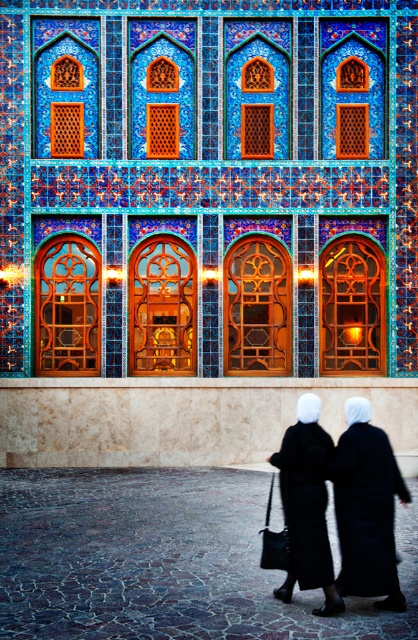
The image size is (418, 640). I want to click on blue mosaic tiles at center, so [203, 225].

Between blue mosaic tiles at center and black matte hijab at center, which one appears on the left side from the viewer's perspective?

From the viewer's perspective, blue mosaic tiles at center appears more on the left side.

Which is in front, point (12, 61) or point (407, 499)?

Point (407, 499) is in front.

Find the location of a particular element. blue mosaic tiles at center is located at coordinates (203, 225).

Which is below, black matte hijab at center or black matte robe at lower center?

black matte hijab at center is below.

Is black matte hijab at center wider than black matte robe at lower center?

No, black matte hijab at center is not wider than black matte robe at lower center.

Describe the element at coordinates (367, 508) in the screenshot. The width and height of the screenshot is (418, 640). I see `black matte hijab at center` at that location.

Locate an element on the screen. This screenshot has height=640, width=418. black matte hijab at center is located at coordinates (367, 508).

Who is shorter, blue mosaic tiles at center or black matte robe at center?

→ With less height is black matte robe at center.

Which is behind, point (181, 51) or point (325, 432)?

Point (181, 51)

Find the location of a particular element. This screenshot has width=418, height=640. blue mosaic tiles at center is located at coordinates (203, 225).